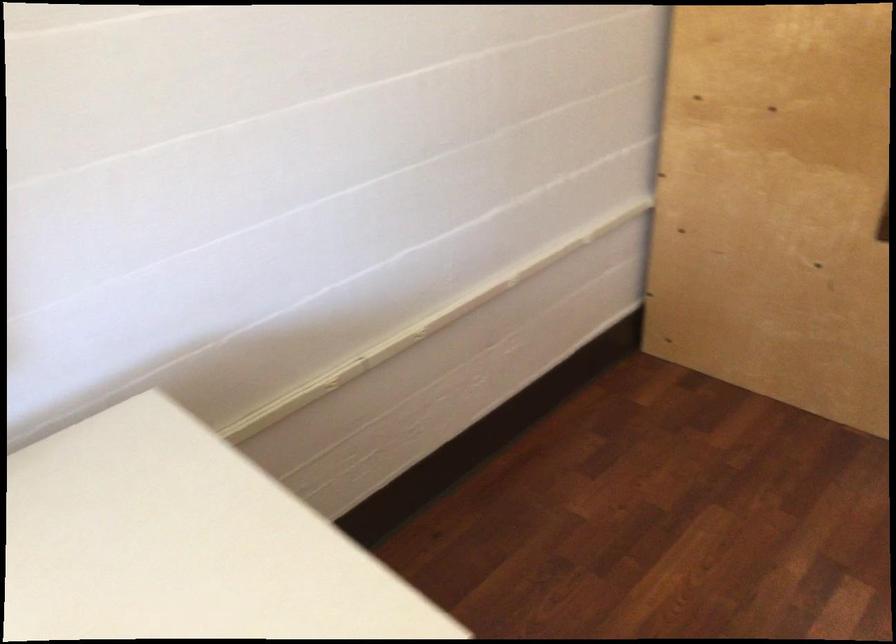
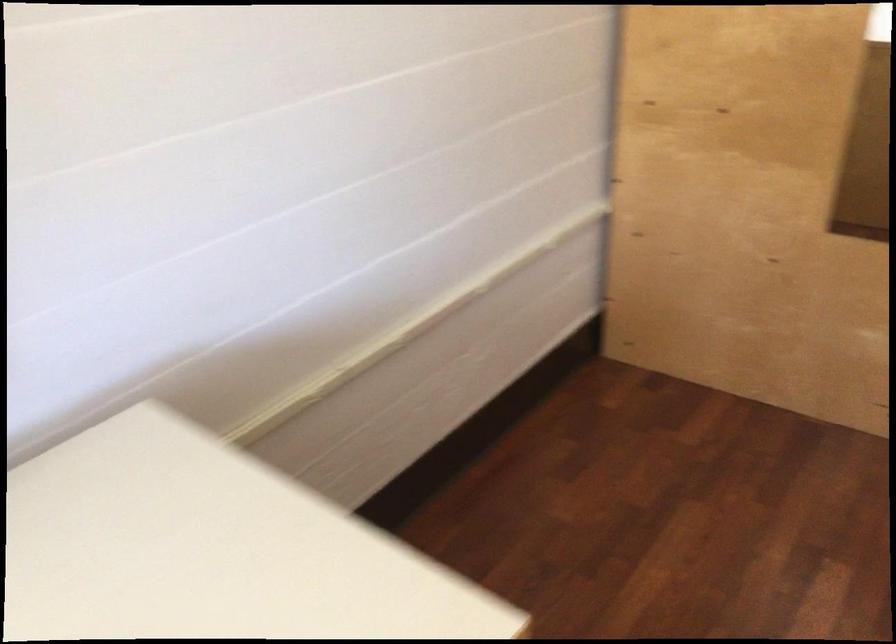
Question: The camera is either moving clockwise (left) or counter-clockwise (right) around the object. The first image is from the beginning of the video and the second image is from the end. Is the camera moving left or right when shooting the video?

Choices:
 (A) Left
 (B) Right

Answer: (A)